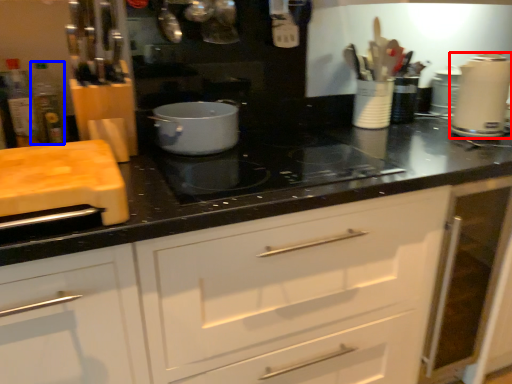
Question: Among these objects, which one is nearest to the camera, kitchen appliance (highlighted by a red box) or bottle (highlighted by a blue box)?

Choices:
 (A) kitchen appliance
 (B) bottle

Answer: (B)